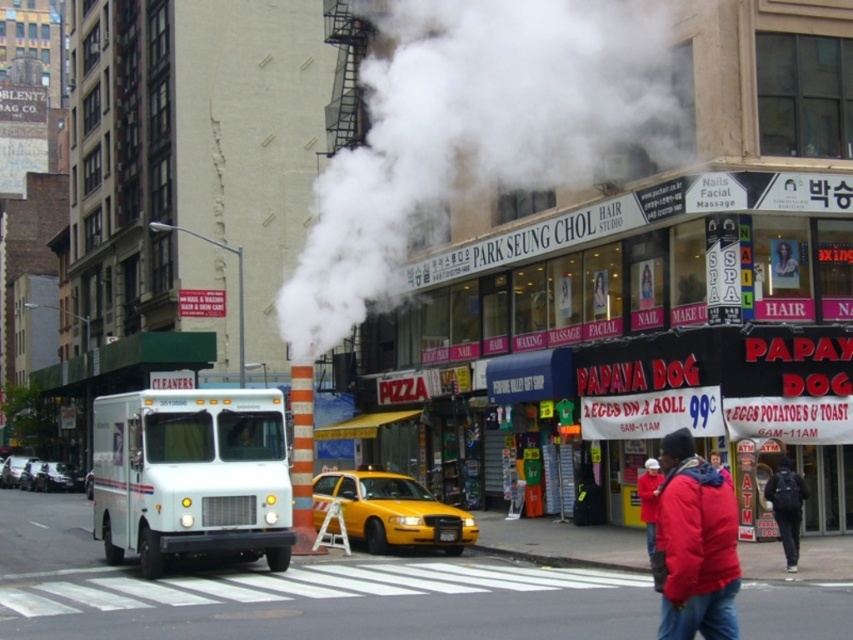
Question: Which point is closer to the camera taking this photo?

Choices:
 (A) (448, 529)
 (B) (703, 627)
 (C) (576, 134)

Answer: (B)

Question: Which point is closer to the camera?

Choices:
 (A) dark blue jacket at lower right
 (B) yellow matte taxi at center
 (C) white steam at center

Answer: (A)

Question: Is yellow matte taxi at center wider than dark blue jacket at lower right?

Choices:
 (A) yes
 (B) no

Answer: (A)

Question: Among these objects, which one is nearest to the camera?

Choices:
 (A) red matte jacket at lower right
 (B) white steam at center
 (C) yellow matte taxi at center

Answer: (A)

Question: Is white steam at center closer to the viewer compared to dark blue jacket at lower right?

Choices:
 (A) yes
 (B) no

Answer: (B)

Question: Does yellow matte taxi at center appear on the right side of dark blue jacket at lower right?

Choices:
 (A) no
 (B) yes

Answer: (A)